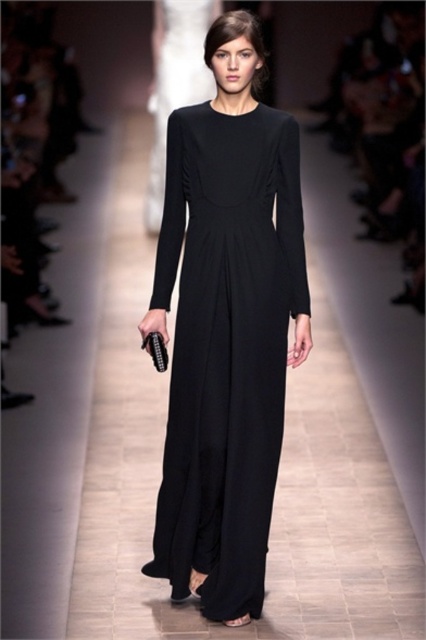
Question: Is black matte dress at center further to camera compared to matte black dress at center?

Choices:
 (A) yes
 (B) no

Answer: (B)

Question: Can you confirm if black matte dress at center is positioned to the right of matte black dress at center?

Choices:
 (A) yes
 (B) no

Answer: (A)

Question: Which point is farther from the camera taking this photo?

Choices:
 (A) (178, 90)
 (B) (189, 193)

Answer: (A)

Question: Where is black matte dress at center located in relation to matte black dress at center in the image?

Choices:
 (A) left
 (B) right

Answer: (B)